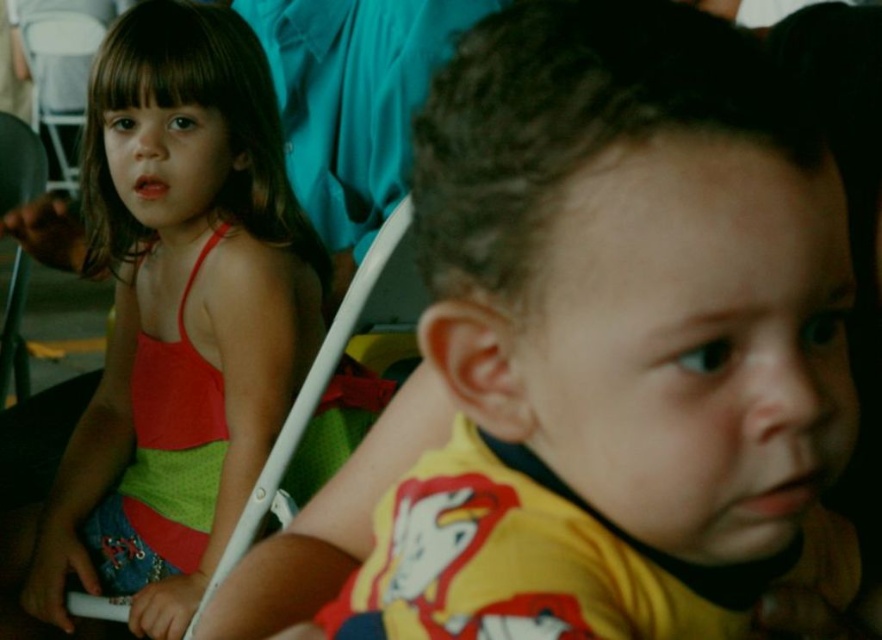
Consider the image. Who is shorter, matte red tank top at left or white plastic chair at center?

white plastic chair at center is shorter.

Is matte red tank top at left to the left of white plastic chair at center from the viewer's perspective?

Correct, you'll find matte red tank top at left to the left of white plastic chair at center.

Identify the location of matte red tank top at left. This screenshot has width=882, height=640. (184, 284).